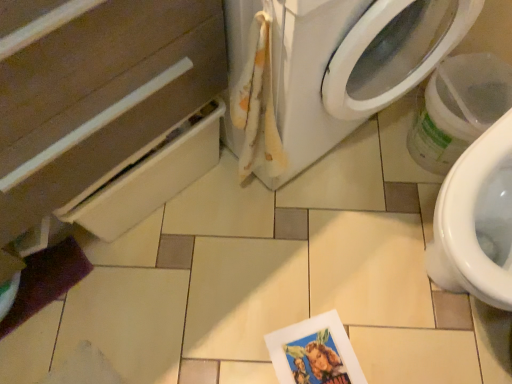
Question: From the image's perspective, relative to printed paper postcard at lower center, is white fabric washing machine at center above or below?

Choices:
 (A) above
 (B) below

Answer: (A)

Question: In the image, is white fabric washing machine at center on the left side or the right side of printed paper postcard at lower center?

Choices:
 (A) right
 (B) left

Answer: (B)

Question: Estimate the real-world distances between objects in this image. Which object is farther from the white fabric washing machine at center?

Choices:
 (A) printed paper postcard at lower center
 (B) matte white drawer at lower left
 (C) fluffy white towel at upper center

Answer: (A)

Question: Estimate the real-world distances between objects in this image. Which object is closer to the printed paper postcard at lower center?

Choices:
 (A) white fabric washing machine at center
 (B) fluffy white towel at upper center
 (C) matte white drawer at lower left

Answer: (B)